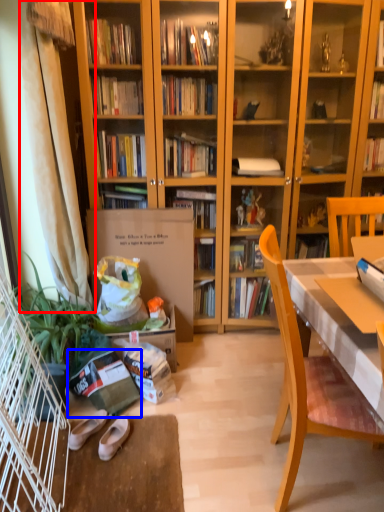
Question: Which object is further to the camera taking this photo, curtain (highlighted by a red box) or paperback book (highlighted by a blue box)?

Choices:
 (A) curtain
 (B) paperback book

Answer: (B)